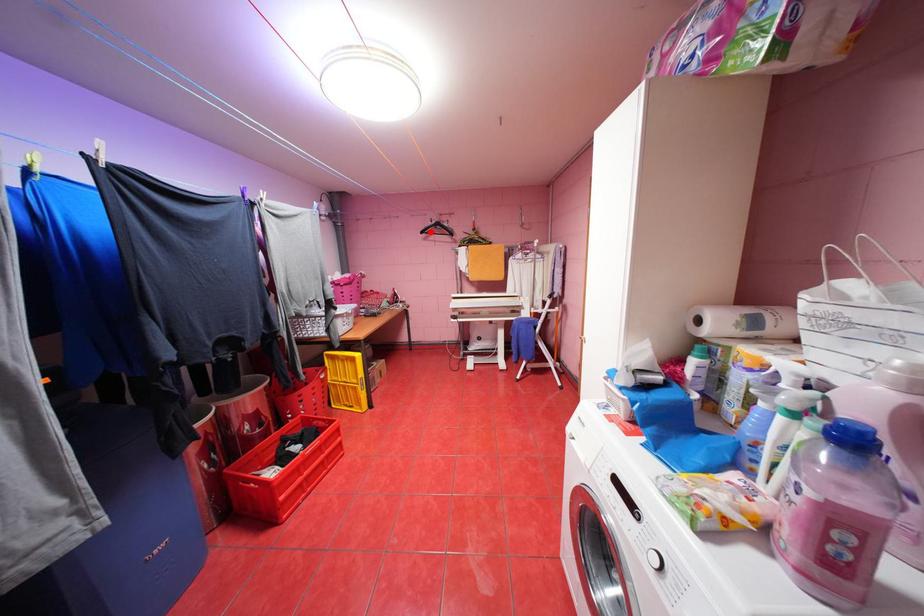
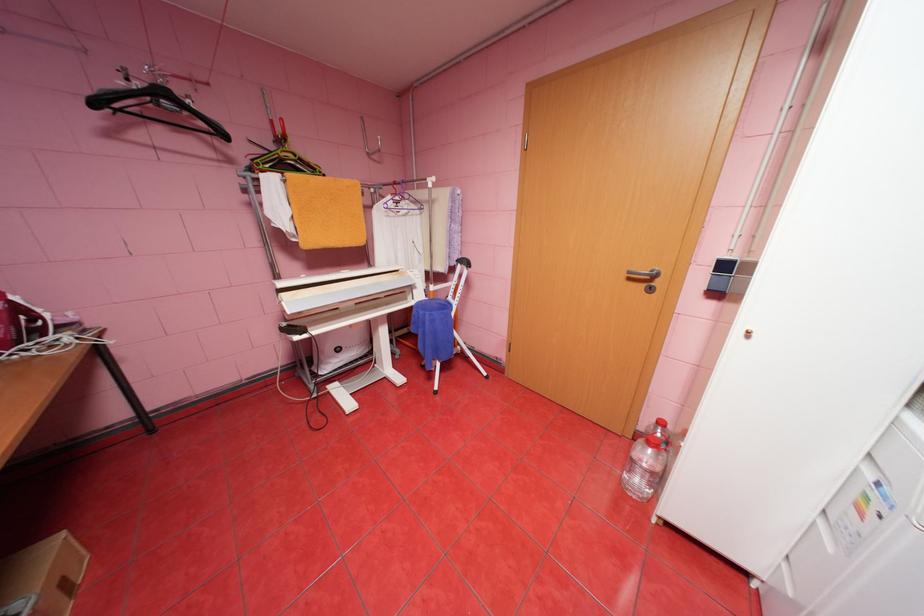
Question: I am providing you with two images of the same scene from different viewpoints. A red point is shown in image1. For the corresponding object point in image2, is it positioned nearer or farther from the camera?

Choices:
 (A) Nearer
 (B) Farther

Answer: (B)